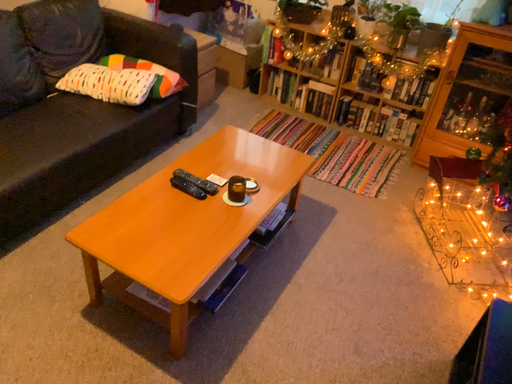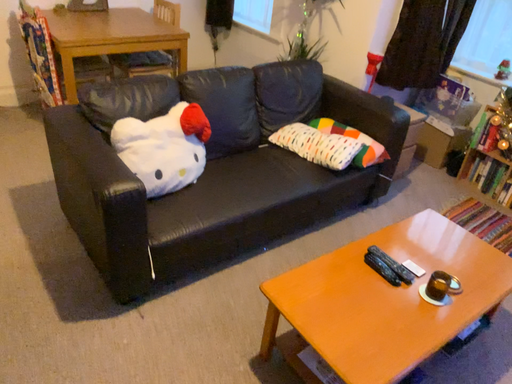
Question: Which way did the camera rotate in the video?

Choices:
 (A) rotated left
 (B) rotated right

Answer: (A)